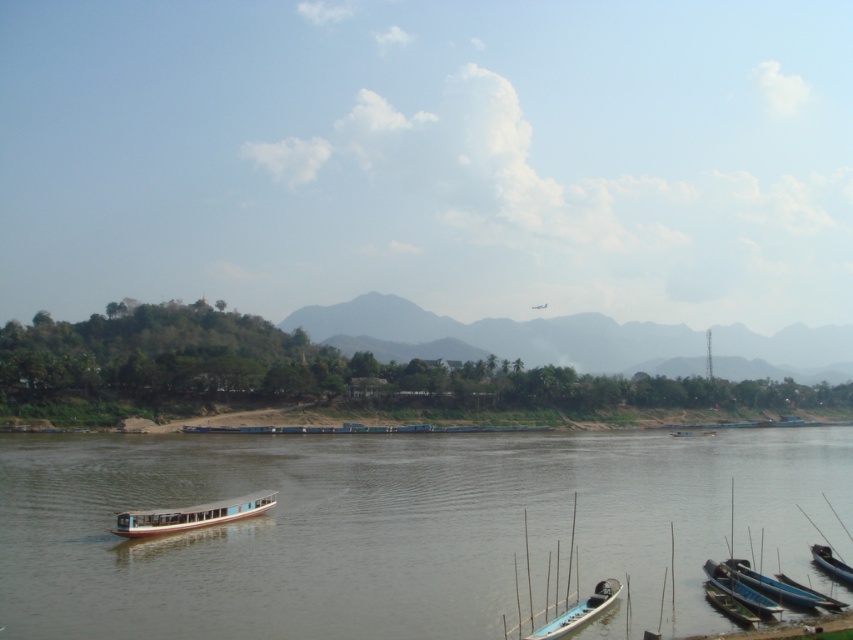
You are planning to cross the river using the light blue plastic canoe at lower right. Given the size of the brown matte river at center, do you think the canoe will be stable enough for your journey?

The brown matte river at center is bigger than the light blue plastic canoe at lower right, so the canoe might not be stable enough for crossing such a large river.

You are standing on the riverside and want to cross the river to the opposite bank. The brown matte river at center is in front of you. If your average walking speed is 1.5 meters per second, how long would it take you to walk across the river?

The brown matte river at center is 24.63 meters from viewer. At a walking speed of 1.5 meters per second, it would take approximately 16.42 seconds to cross the river.

You are standing at the point with coordinates (579, 611) in the image. What object are you standing on?

You are standing on the light blue plastic canoe at lower right.